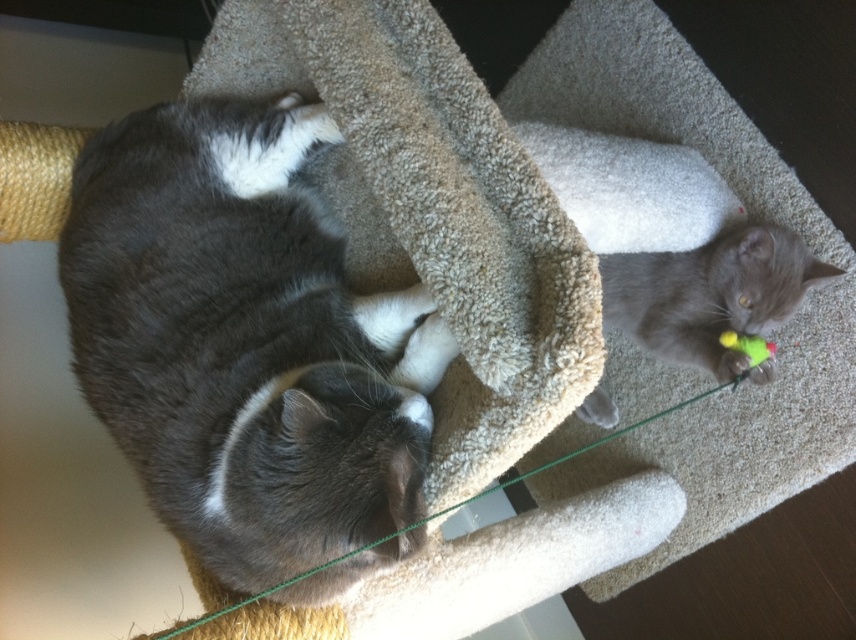
Question: Is gray fluffy cat at left above gray soft toy at right?

Choices:
 (A) no
 (B) yes

Answer: (B)

Question: Does gray soft toy at right have a larger size compared to green string at center?

Choices:
 (A) no
 (B) yes

Answer: (B)

Question: Which object is positioned farthest from the gray soft toy at right?

Choices:
 (A) gray fluffy cat at left
 (B) green string at center

Answer: (A)

Question: Is gray soft toy at right thinner than green string at center?

Choices:
 (A) yes
 (B) no

Answer: (A)

Question: Which is nearer to the gray fluffy cat at left?

Choices:
 (A) green fuzzy toy at right
 (B) gray soft toy at right
 (C) green string at center

Answer: (C)

Question: Which point appears closest to the camera in this image?

Choices:
 (A) (736, 344)
 (B) (120, 346)
 (C) (598, 444)

Answer: (B)